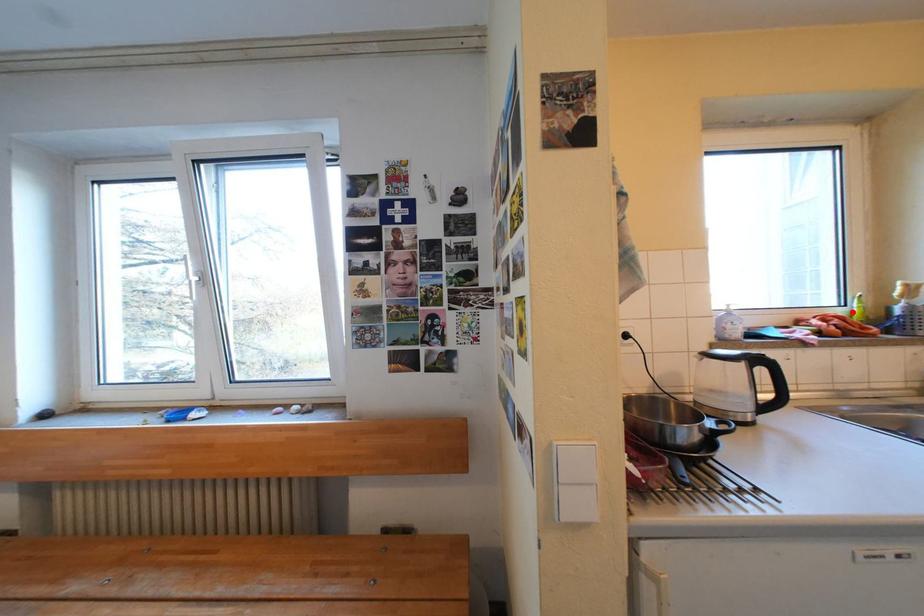
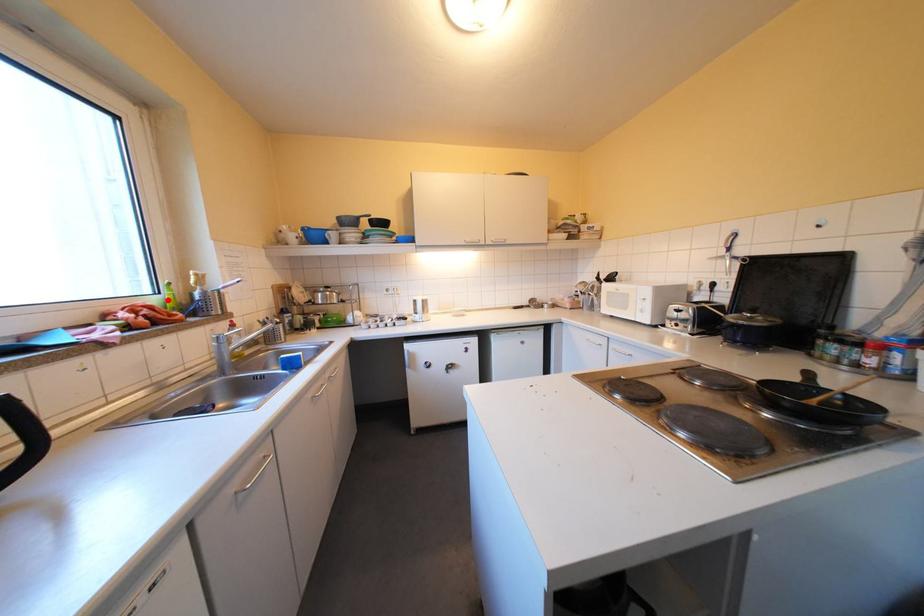
Looking at this image, I am providing you with two images of the same scene from different viewpoints. A red point is marked on the first image and another point is marked on the second image. Is the red point in image1 aligned with the point shown in image2?

Yes